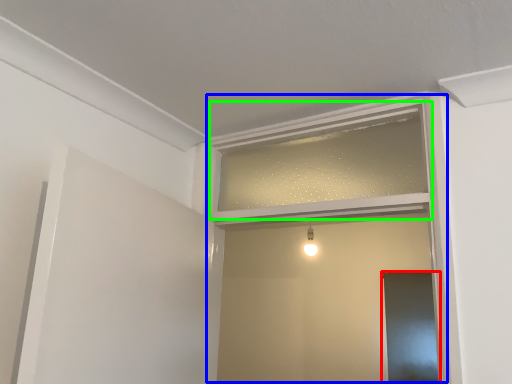
Question: Which is nearer to the screen door (highlighted by a red box)? window frame (highlighted by a blue box) or window frame (highlighted by a green box).

Choices:
 (A) window frame
 (B) window frame

Answer: (B)